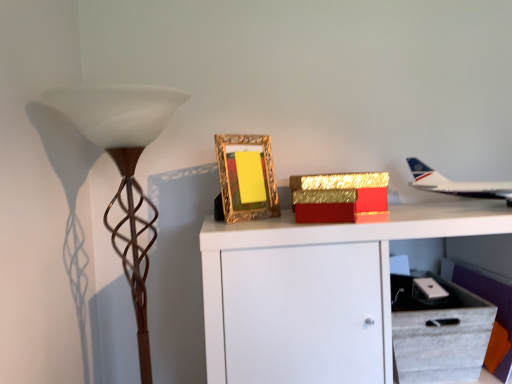
The width and height of the screenshot is (512, 384). I want to click on gold ornate frame at center, so click(x=246, y=177).

The image size is (512, 384). Find the location of `white glossy airplane at upper right`. white glossy airplane at upper right is located at coordinates (457, 184).

In order to face white glossy airplane at upper right, should I rotate leftwards or rightwards?

To align with it, rotate right about 25.833°.

The height and width of the screenshot is (384, 512). What do you see at coordinates (124, 170) in the screenshot?
I see `brown textured floor lamp at left` at bounding box center [124, 170].

Locate an element on the screen. Image resolution: width=512 pixels, height=384 pixels. gold ornate frame at center is located at coordinates (246, 177).

From a real-world perspective, which is physically below, white glossy airplane at upper right or brown textured floor lamp at left?

brown textured floor lamp at left.

From the image's perspective, which object appears higher, white glossy airplane at upper right or brown textured floor lamp at left?

white glossy airplane at upper right appears higher in the image.

Is white glossy airplane at upper right aimed at brown textured floor lamp at left?

No.

Who is smaller, white glossy airplane at upper right or brown textured floor lamp at left?

white glossy airplane at upper right is smaller.

Is point (261, 162) positioned after point (484, 192)?

No.

Based on the photo, is white glossy airplane at upper right at the back of gold ornate frame at center?

No.

From the image's perspective, between gold ornate frame at center and white glossy airplane at upper right, who is located below?

white glossy airplane at upper right is shown below in the image.

Are gold ornate frame at center and white glossy airplane at upper right located far from each other?

No.

From a real-world perspective, relative to brown textured floor lamp at left, is white fabric drawer at lower right vertically above or below?

Clearly, from a real-world perspective, white fabric drawer at lower right is below brown textured floor lamp at left.

Would you say white fabric drawer at lower right is outside brown textured floor lamp at left?

Yes.

From the image's perspective, who appears lower, white fabric drawer at lower right or brown textured floor lamp at left?

white fabric drawer at lower right appears lower in the image.

From the picture: Considering their positions, is white fabric drawer at lower right located in front of or behind brown textured floor lamp at left?

Clearly, white fabric drawer at lower right is behind brown textured floor lamp at left.

Is gold glittery box at upper center aimed at white fabric drawer at lower right?

No, gold glittery box at upper center does not turn towards white fabric drawer at lower right.

In terms of height, does gold glittery box at upper center look taller or shorter compared to white fabric drawer at lower right?

Considering their sizes, gold glittery box at upper center has less height than white fabric drawer at lower right.

Measure the distance from gold glittery box at upper center to white fabric drawer at lower right.

They are 11.36 inches apart.

Locate an element on the screen. drawer lying in front of the gold glittery box at upper center is located at coordinates (x=439, y=333).

From a real-world perspective, which is physically above, white glossy airplane at upper right or white fabric drawer at lower right?

white glossy airplane at upper right is physically above.

Is white glossy airplane at upper right completely or partially outside of white fabric drawer at lower right?

white glossy airplane at upper right is positioned outside white fabric drawer at lower right.

Considering the relative positions of white glossy airplane at upper right and white fabric drawer at lower right in the image provided, is white glossy airplane at upper right to the right of white fabric drawer at lower right from the viewer's perspective?

Yes, white glossy airplane at upper right is to the right of white fabric drawer at lower right.

Can you confirm if brown textured floor lamp at left is smaller than white fabric drawer at lower right?

No.

Is brown textured floor lamp at left located outside white fabric drawer at lower right?

brown textured floor lamp at left is positioned outside white fabric drawer at lower right.

How different are the orientations of brown textured floor lamp at left and white fabric drawer at lower right in degrees?

The angle between the facing direction of brown textured floor lamp at left and the facing direction of white fabric drawer at lower right is 0.0983 degrees.

Between brown textured floor lamp at left and white fabric drawer at lower right, which one has less height?

Standing shorter between the two is white fabric drawer at lower right.

Does point (132, 230) appear closer or farther from the camera than point (342, 221)?

Point (132, 230) appears to be farther away from the viewer than point (342, 221).

Could you tell me if brown textured floor lamp at left is turned towards gold glittery box at upper center?

No, brown textured floor lamp at left is not aimed at gold glittery box at upper center.

Which is correct: brown textured floor lamp at left is inside gold glittery box at upper center, or outside of it?

brown textured floor lamp at left lies outside gold glittery box at upper center.

Who is more distant, brown textured floor lamp at left or gold glittery box at upper center?

gold glittery box at upper center is further from the camera.

This screenshot has width=512, height=384. I want to click on table lamp that appears below the white glossy airplane at upper right (from the image's perspective), so click(x=124, y=170).

Identify the location of picture frame behind the white glossy airplane at upper right. (246, 177).

Which object lies further to the anchor point brown textured floor lamp at left, gold glittery box at upper center or white fabric drawer at lower right?

white fabric drawer at lower right lies further to brown textured floor lamp at left than the other object.

Based on their spatial positions, is white glossy airplane at upper right or gold glittery box at upper center further from gold ornate frame at center?

white glossy airplane at upper right is further to gold ornate frame at center.

Which object lies nearer to the anchor point white glossy airplane at upper right, gold ornate frame at center or gold glittery box at upper center?

gold glittery box at upper center is positioned closer to the anchor white glossy airplane at upper right.

Which object lies further to the anchor point white glossy airplane at upper right, gold ornate frame at center or brown textured floor lamp at left?

Based on the image, brown textured floor lamp at left appears to be further to white glossy airplane at upper right.

Based on their spatial positions, is white fabric drawer at lower right or white glossy airplane at upper right further from gold glittery box at upper center?

The object further to gold glittery box at upper center is white fabric drawer at lower right.

Looking at the image, which one is located closer to gold glittery box at upper center, brown textured floor lamp at left or gold ornate frame at center?

gold ornate frame at center is closer to gold glittery box at upper center.

Which object lies nearer to the anchor point gold glittery box at upper center, brown textured floor lamp at left or white fabric drawer at lower right?

white fabric drawer at lower right lies closer to gold glittery box at upper center than the other object.

From the image, which object appears to be farther from white fabric drawer at lower right, brown textured floor lamp at left or gold glittery box at upper center?

The object further to white fabric drawer at lower right is brown textured floor lamp at left.

Find the location of a particular element. This screenshot has height=384, width=512. picture frame between brown textured floor lamp at left and gold glittery box at upper center is located at coordinates (246, 177).

At what (x,y) coordinates should I click in order to perform the action: click on box located between brown textured floor lamp at left and white fabric drawer at lower right in the left-right direction. Please return your answer as a coordinate pair (x, y). Looking at the image, I should click on (338, 196).

At what (x,y) coordinates should I click in order to perform the action: click on picture frame between brown textured floor lamp at left and white fabric drawer at lower right from left to right. Please return your answer as a coordinate pair (x, y). The height and width of the screenshot is (384, 512). Looking at the image, I should click on (246, 177).

Where is `box between white glossy airplane at upper right and white fabric drawer at lower right from top to bottom`? box between white glossy airplane at upper right and white fabric drawer at lower right from top to bottom is located at coordinates (338, 196).